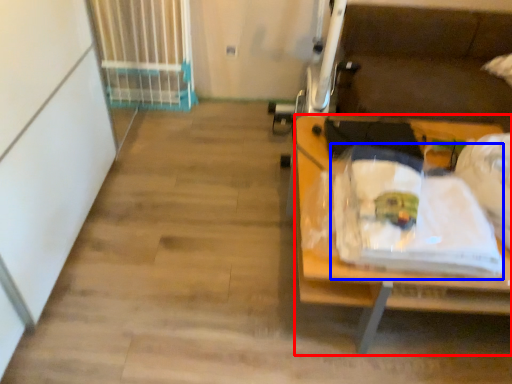
Question: Among these objects, which one is nearest to the camera, desk (highlighted by a red box) or waste (highlighted by a blue box)?

Choices:
 (A) desk
 (B) waste

Answer: (B)